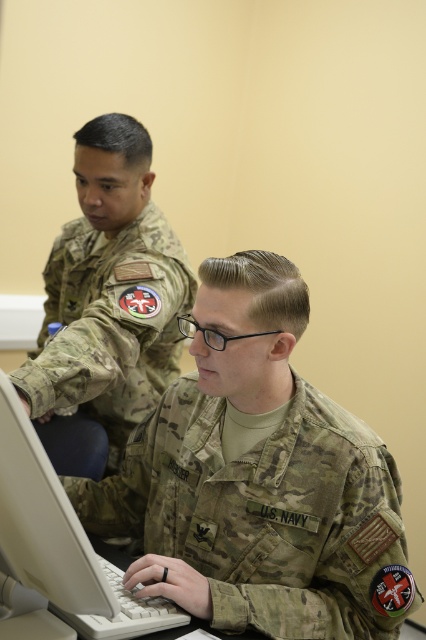
What is the exact coordinate of the camouflage fabric us navy uniform at center?

The camouflage fabric us navy uniform at center is located at coordinate point (265,515).

Looking at this image, you are a military recruit standing in the same room as the camouflage uniform at center. You need to hand a document to someone standing 1.5 meters away from you. Can you reach them without moving from your current position?

The camouflage uniform at center and viewer are 1.24 meters apart from each other, so yes, you can reach them without moving since 1.24 meters is less than 1.5 meters.